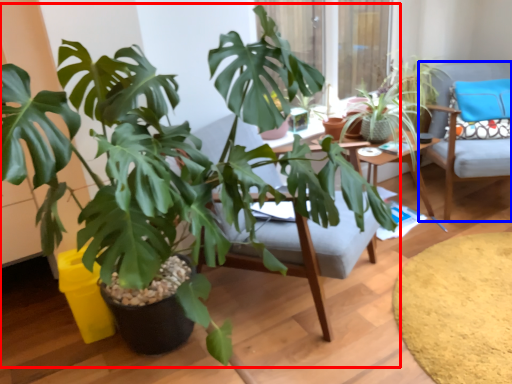
Question: Which object appears closest to the camera in this image, houseplant (highlighted by a red box) or chair (highlighted by a blue box)?

Choices:
 (A) houseplant
 (B) chair

Answer: (A)